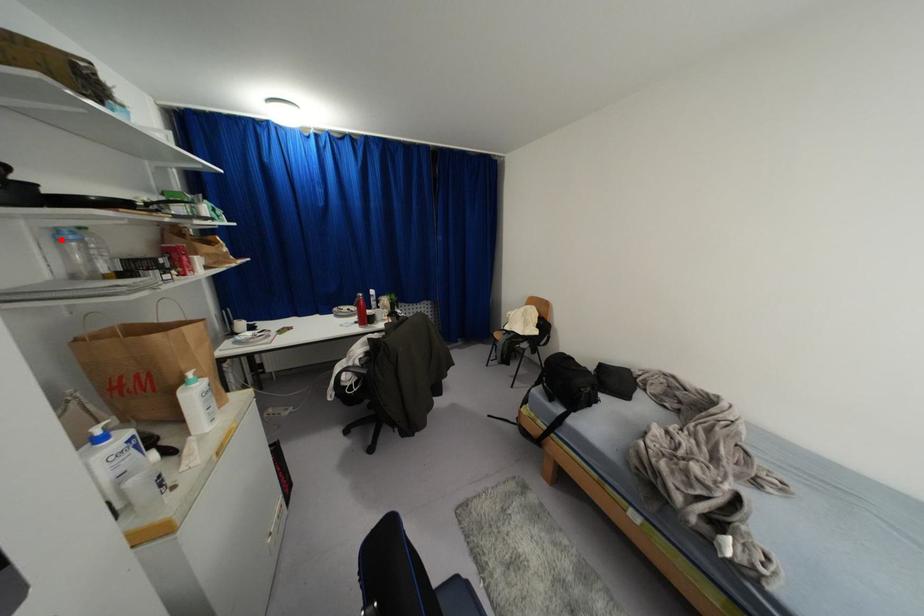
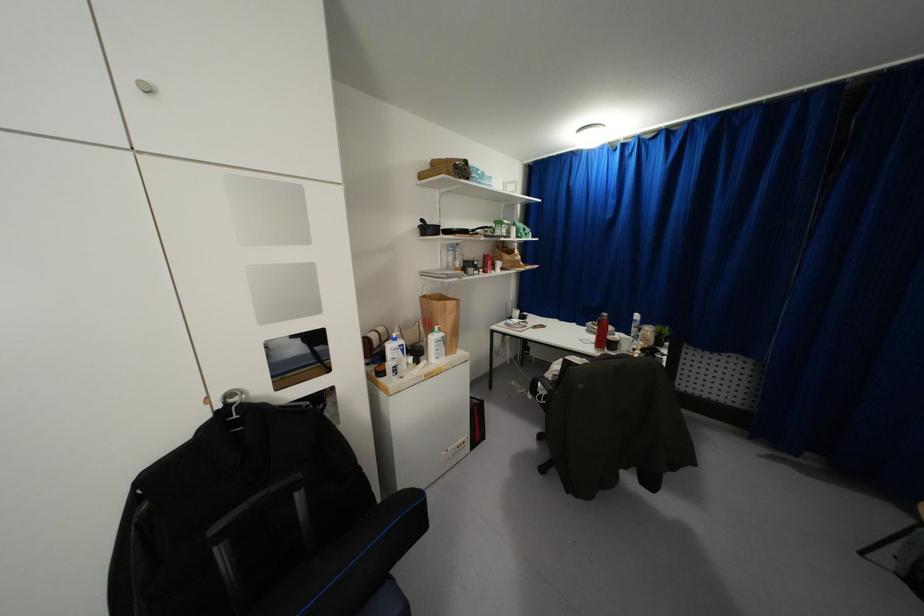
Where in the second image is the point corresponding to the highlighted location from the first image?

(446, 249)